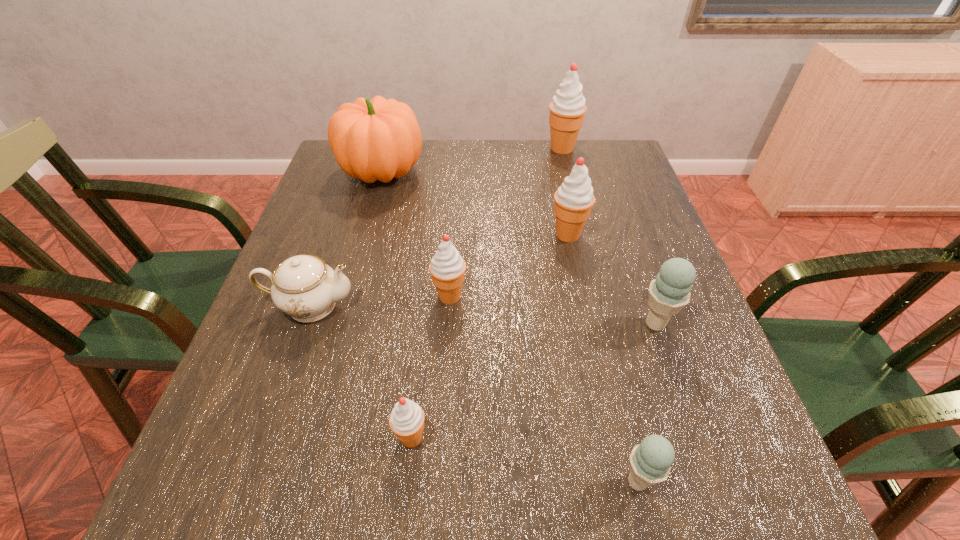
Locate which red icecream ranks in proximity to the fifth nearest ice cream. Please provide its 2D coordinates. Your answer should be formatted as a tuple, i.e. [(x, y)], where the tuple contains the x and y coordinates of a point satisfying the conditions above.

[(447, 267)]

I want to click on free space that satisfies the following two spatial constraints: 1. on the back side of the third farthest red icecream; 2. on the left side of the nearest red icecream, so click(427, 296).

Locate an element on the screen. Image resolution: width=960 pixels, height=540 pixels. free spot that satisfies the following two spatial constraints: 1. at the spout of the nearer blue ice cream; 2. on the left side of the chinaware is located at coordinates (249, 482).

At what (x,y) coordinates should I click in order to perform the action: click on vacant region that satisfies the following two spatial constraints: 1. on the front side of the third biggest red icecream; 2. on the right side of the rightmost object. Please return your answer as a coordinate pair (x, y). The height and width of the screenshot is (540, 960). Looking at the image, I should click on (448, 324).

I want to click on free space that satisfies the following two spatial constraints: 1. at the spout of the left blue ice cream; 2. on the right side of the chinaware, so click(x=249, y=482).

Find the location of `vacant space that satisfies the following two spatial constraints: 1. on the back side of the farthest red icecream; 2. on the right side of the second nearest ice cream`. vacant space that satisfies the following two spatial constraints: 1. on the back side of the farthest red icecream; 2. on the right side of the second nearest ice cream is located at coordinates (444, 148).

The image size is (960, 540). Identify the location of free space in the image that satisfies the following two spatial constraints: 1. on the front side of the rightmost ice cream; 2. on the right side of the tallest object. (606, 324).

The width and height of the screenshot is (960, 540). Identify the location of free space that satisfies the following two spatial constraints: 1. on the front side of the second biggest red icecream; 2. on the right side of the rightmost object. (587, 324).

This screenshot has width=960, height=540. In order to click on vacant space that satisfies the following two spatial constraints: 1. on the back side of the rightmost ice cream; 2. at the spout of the chinaware in this screenshot , I will do `click(649, 305)`.